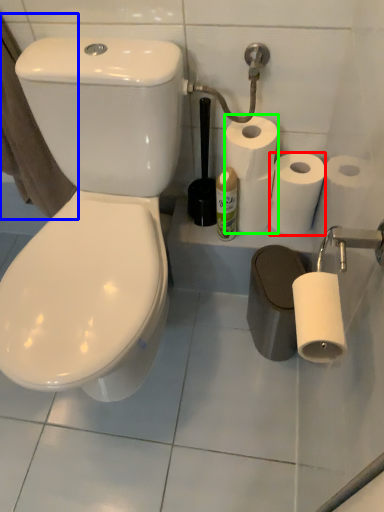
Question: Which object is the closest to the toilet paper (highlighted by a red box)? Choose among these: bath towel (highlighted by a blue box) or toilet paper (highlighted by a green box).

Choices:
 (A) bath towel
 (B) toilet paper

Answer: (B)